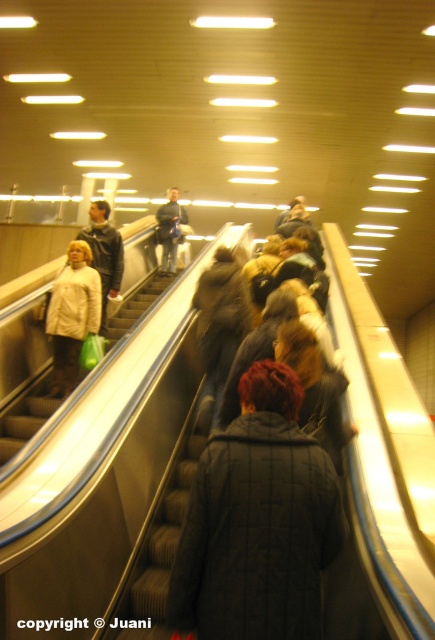
Is beige quilted coat at center thinner than dark gray jacket at center?

Incorrect, beige quilted coat at center's width is not less than dark gray jacket at center's.

Can you confirm if beige quilted coat at center is positioned to the left of dark gray jacket at center?

Correct, you'll find beige quilted coat at center to the left of dark gray jacket at center.

Is point (87, 314) farther from viewer compared to point (163, 241)?

No, (87, 314) is closer to viewer.

The width and height of the screenshot is (435, 640). What are the coordinates of `beige quilted coat at center` in the screenshot? It's located at 72,314.

Is point (83, 278) positioned after point (106, 243)?

That is False.

Identify the location of beige quilted coat at center. (72, 314).

Is matte black jacket at left to the right of dark gray jacket at center from the viewer's perspective?

Incorrect, matte black jacket at left is not on the right side of dark gray jacket at center.

Does matte black jacket at left appear over dark gray jacket at center?

Actually, matte black jacket at left is below dark gray jacket at center.

This screenshot has height=640, width=435. I want to click on matte black jacket at left, so click(x=103, y=253).

I want to click on matte black jacket at left, so click(x=103, y=253).